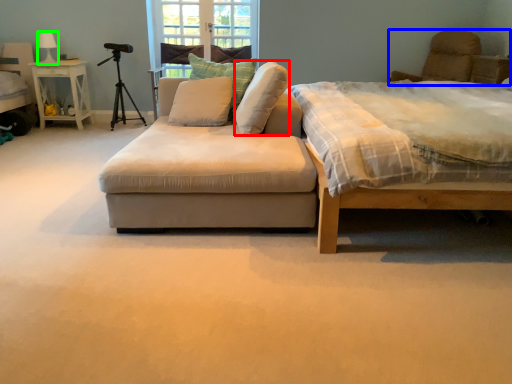
Question: Based on their relative distances, which object is nearer to pillow (highlighted by a red box)? Choose from swivel chair (highlighted by a blue box) and lamp (highlighted by a green box).

Choices:
 (A) swivel chair
 (B) lamp

Answer: (B)